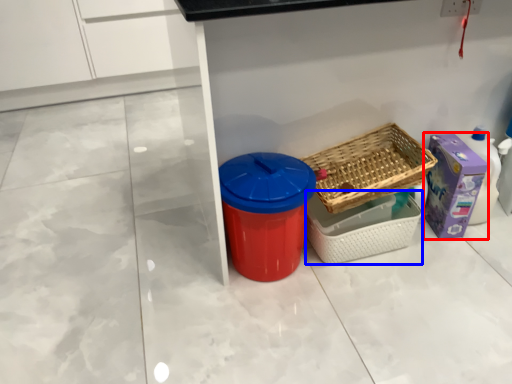
Question: Which object is closer to the camera taking this photo, storage box (highlighted by a red box) or basket (highlighted by a blue box)?

Choices:
 (A) storage box
 (B) basket

Answer: (B)